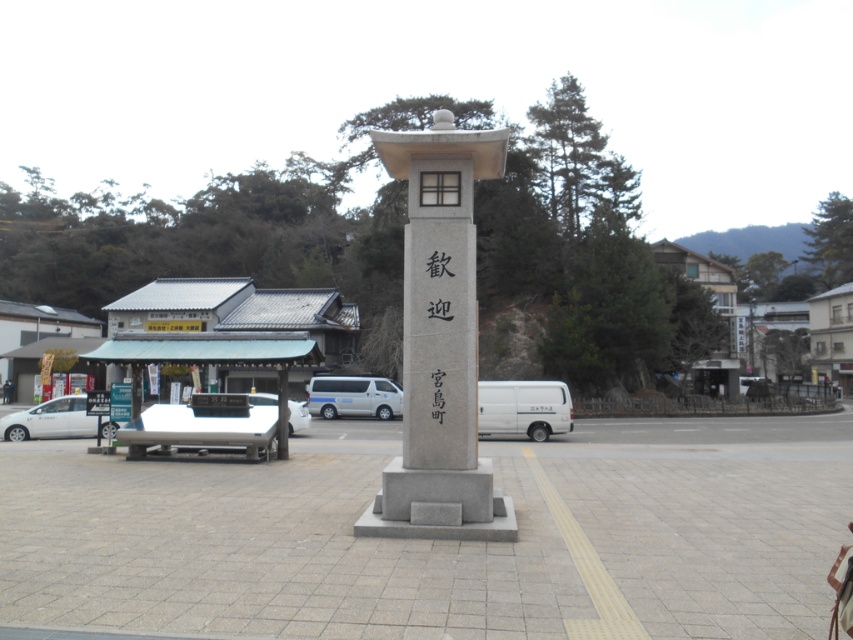
Question: Does white matte van at center appear over black stone writing at center?

Choices:
 (A) yes
 (B) no

Answer: (B)

Question: Estimate the real-world distances between objects in this image. Which object is closer to the white glossy van at center?

Choices:
 (A) white matte van at center
 (B) gray stone monument at center
 (C) white matte van at lower left

Answer: (C)

Question: Among these objects, which one is nearest to the camera?

Choices:
 (A) gray stone monument at center
 (B) black stone writing at center
 (C) white matte van at center
 (D) white glossy van at center

Answer: (A)

Question: Observing the image, what is the correct spatial positioning of gray stone monument at center in reference to white glossy van at center?

Choices:
 (A) right
 (B) left

Answer: (A)

Question: Which point is closer to the camera taking this photo?

Choices:
 (A) (419, 346)
 (B) (303, 401)
 (C) (434, 369)
 (D) (78, 406)

Answer: (C)

Question: Does gray stone monument at center come in front of white matte van at center?

Choices:
 (A) no
 (B) yes

Answer: (B)